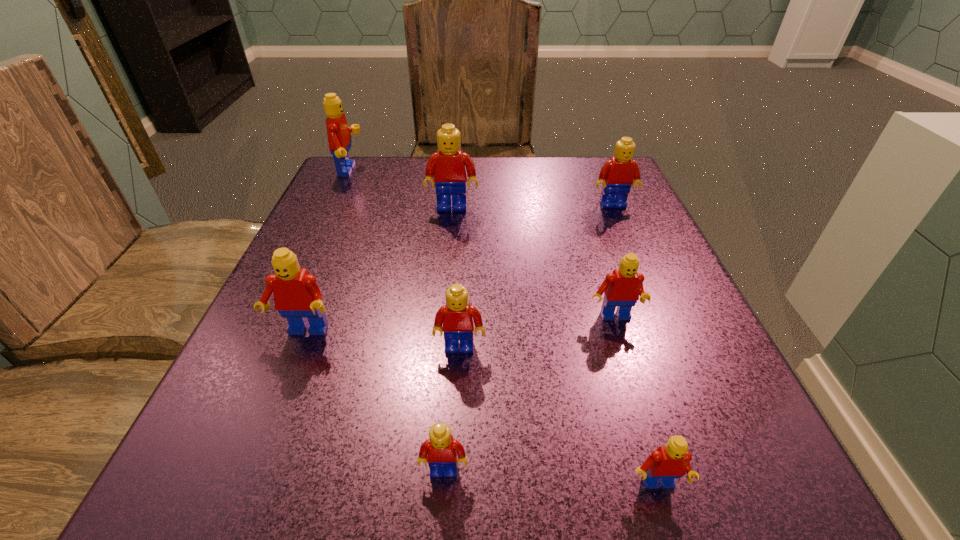
Identify which yellow Lego is located as the second nearest to the third smallest red Lego. Please provide its 2D coordinates. Your answer should be formatted as a tuple, i.e. [(x, y)], where the tuple contains the x and y coordinates of a point satisfying the conditions above.

[(440, 451)]

Point out which yellow Lego is positioned as the third nearest to the second biggest yellow Lego. Please provide its 2D coordinates. Your answer should be formatted as a tuple, i.e. [(x, y)], where the tuple contains the x and y coordinates of a point satisfying the conditions above.

[(440, 451)]